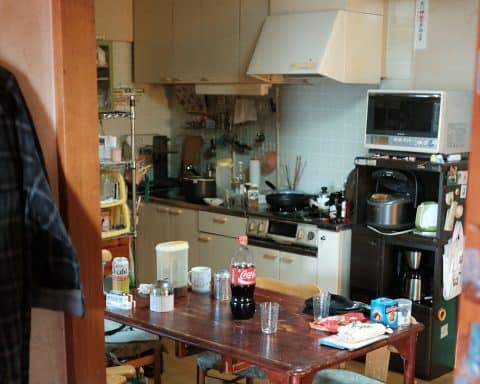
Find the location of a particular element. Image resolution: width=480 pixels, height=384 pixels. wall is located at coordinates (441, 50).